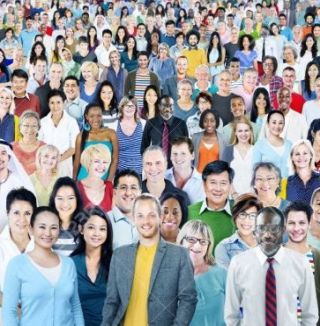
Find the location of a particular element. Image resolution: width=320 pixels, height=326 pixels. lens in glasses is located at coordinates (274, 226), (261, 226), (251, 215), (240, 214), (203, 241), (190, 238), (270, 179), (259, 180).